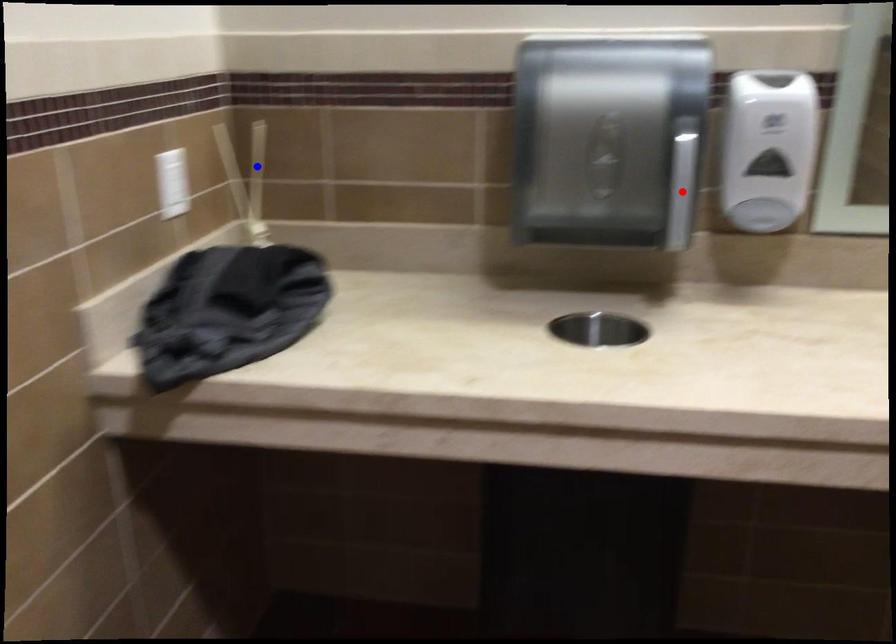
Question: In the image, two points are highlighted. Which point is nearer to the camera? Reply with the corresponding letter.

Choices:
 (A) blue point
 (B) red point

Answer: (B)